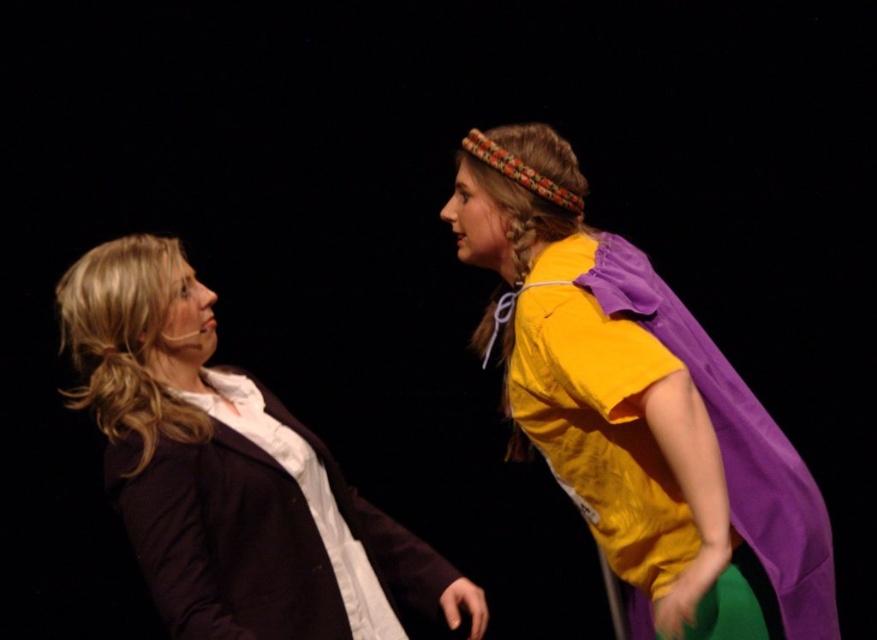
Question: Which point is closer to the camera?

Choices:
 (A) (550, 188)
 (B) (314, 512)

Answer: (A)

Question: Which of the following is the closest to the observer?

Choices:
 (A) yellow matte shirt at upper right
 (B) matte black blazer at left

Answer: (A)

Question: Is yellow matte shirt at upper right wider than matte black blazer at left?

Choices:
 (A) yes
 (B) no

Answer: (B)

Question: Is yellow matte shirt at upper right further to camera compared to matte black blazer at left?

Choices:
 (A) no
 (B) yes

Answer: (A)

Question: Does yellow matte shirt at upper right appear on the left side of matte black blazer at left?

Choices:
 (A) yes
 (B) no

Answer: (B)

Question: Which point appears farthest from the camera in this image?

Choices:
 (A) (822, 586)
 (B) (93, 323)

Answer: (B)